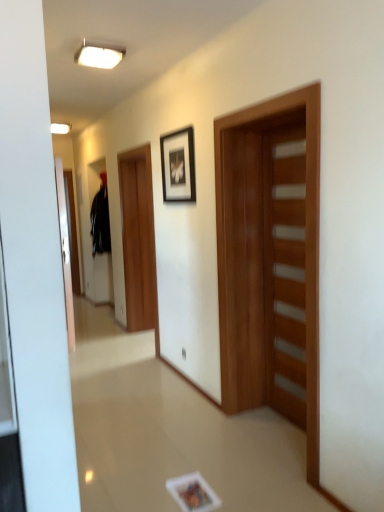
Question: Is white glossy ceiling light at upper center bigger or smaller than wooden door at center, which is the 2th door from right to left?

Choices:
 (A) big
 (B) small

Answer: (B)

Question: From a real-world perspective, is white glossy ceiling light at upper center physically located above or below wooden door at center, marked as the 1th door in a left-to-right arrangement?

Choices:
 (A) below
 (B) above

Answer: (B)

Question: Which object is positioned closest to the white glossy ceiling light at upper center?

Choices:
 (A) wooden door at right, which ranks as the 2th door in left-to-right order
 (B) wooden door at center, marked as the 1th door in a left-to-right arrangement
 (C) black matte picture frame at upper center
 (D) black matte sweatshirt at left

Answer: (C)

Question: Estimate the real-world distances between objects in this image. Which object is farther from the wooden door at center, which is the 2th door from right to left?

Choices:
 (A) wooden door at right, which ranks as the 2th door in left-to-right order
 (B) white glossy ceiling light at upper center
 (C) black matte sweatshirt at left
 (D) black matte picture frame at upper center

Answer: (C)